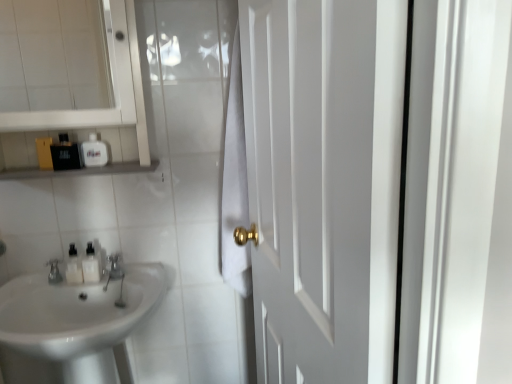
Locate an element on the screen. The width and height of the screenshot is (512, 384). vacant space situated on the left part of matte silver faucet at lower left is located at coordinates (25, 276).